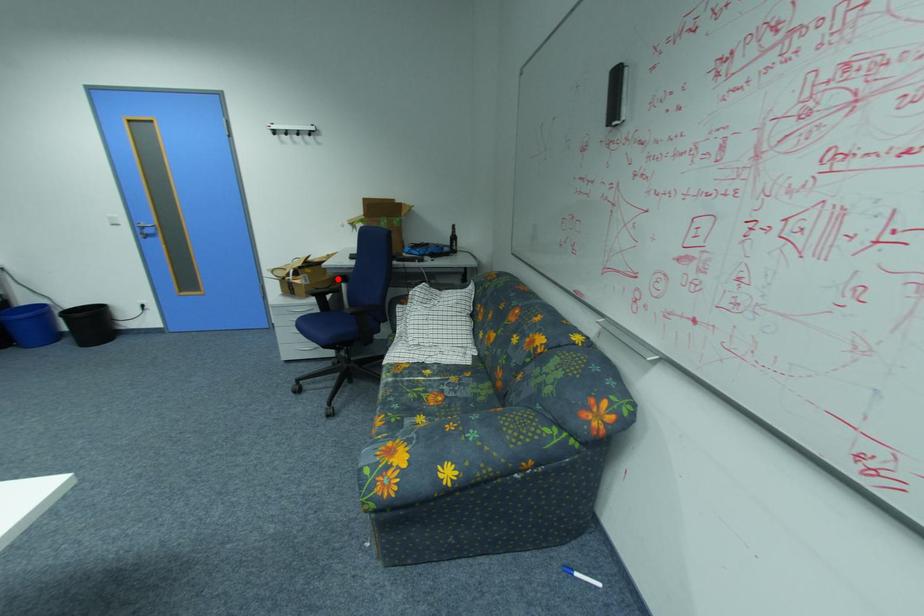
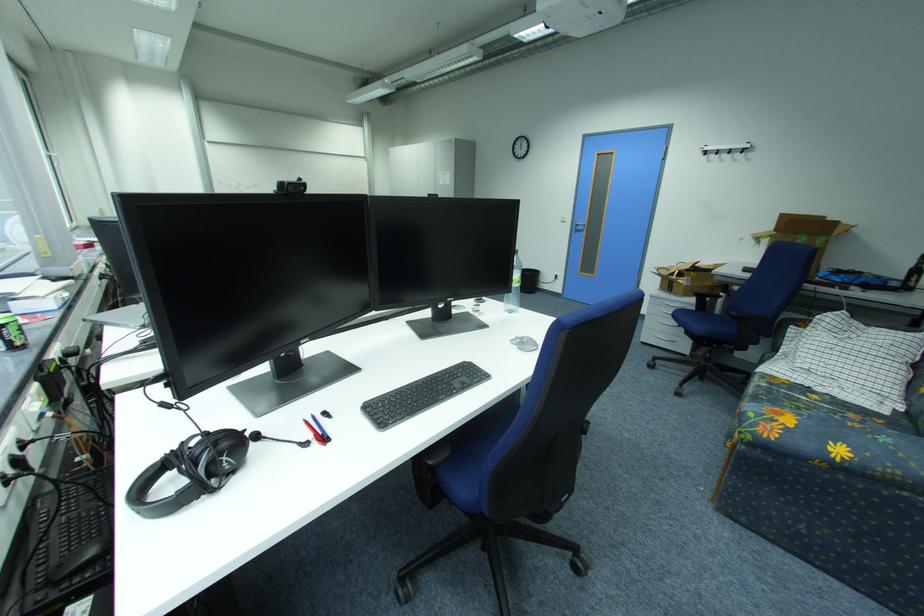
Question: I am providing you with two images of the same scene from different viewpoints. In image1, a red point is highlighted. Considering the same 3D point in image2, which of the following is correct?

Choices:
 (A) It is closer
 (B) It is farther

Answer: (A)